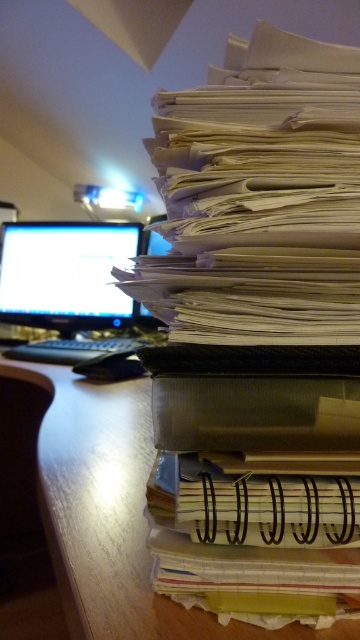
You are organizing your desk and want to place a new plant pot between the wooden at right and the matte black monitor at left. Based on their positions, which object should you place the plant pot closer to if you want it centered between them?

The wooden at right is to the right of the matte black monitor at left, so to center the plant pot between them, place it closer to the matte black monitor at left since it is positioned further left.

You are standing 30 inches away from a desk with a large stack of papers. There is a specific point on the desk at coordinates point (x=108, y=460). Can you reach that point without moving closer to the desk?

The distance of point (x=108, y=460) from viewer is 28.89 inches, which is less than 30 inches. Therefore, you can reach the point without moving closer.

You are organizing your desk and want to place a new item between the wooden at right and the matte black monitor at left. Which object should you place the item closer to if you want it to be near the smaller one?

You should place the item closer to the wooden at right because it is smaller than the matte black monitor at left.